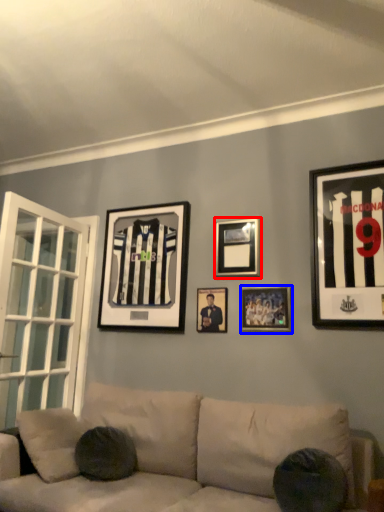
Question: Among these objects, which one is nearest to the camera, picture frame (highlighted by a red box) or picture frame (highlighted by a blue box)?

Choices:
 (A) picture frame
 (B) picture frame

Answer: (B)